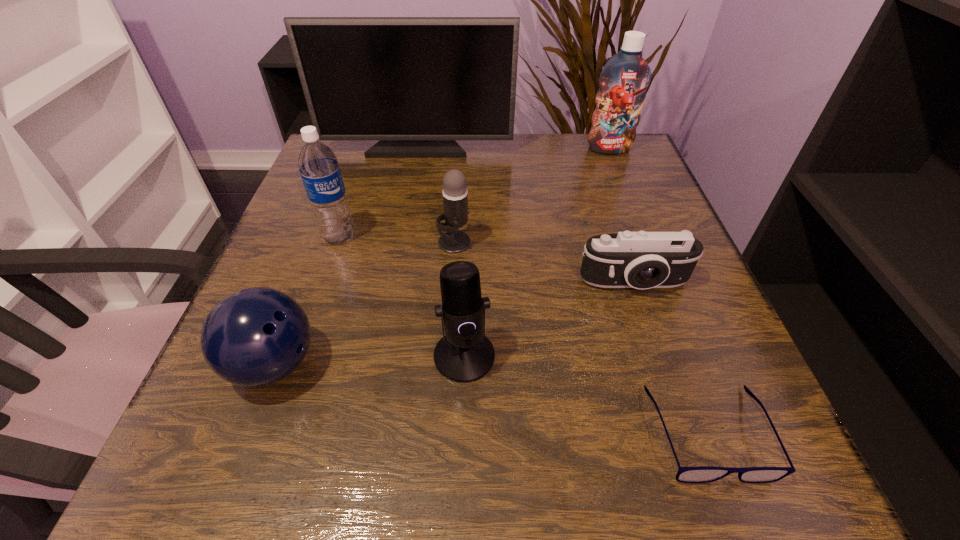
Locate an element on the screen. empty space between the shampoo and the water bottle is located at coordinates (474, 192).

Find the location of a particular element. This screenshot has height=540, width=960. free spot between the shortest object and the sixth tallest object is located at coordinates (492, 399).

Where is `free spot between the shampoo and the spectacles`? Image resolution: width=960 pixels, height=540 pixels. free spot between the shampoo and the spectacles is located at coordinates (659, 291).

Identify the location of free space between the farther microphone and the sixth tallest object. The image size is (960, 540). (364, 303).

The width and height of the screenshot is (960, 540). I want to click on vacant space that is in between the seventh tallest object and the farther microphone, so click(x=544, y=263).

Choose which object is the fourth nearest neighbor to the monitor. Please provide its 2D coordinates. Your answer should be formatted as a tuple, i.e. [(x, y)], where the tuple contains the x and y coordinates of a point satisfying the conditions above.

[(642, 260)]

This screenshot has height=540, width=960. Identify the location of object that is the third closest to the camera. (455, 195).

Locate an element on the screen. Image resolution: width=960 pixels, height=540 pixels. vacant position in the image that satisfies the following two spatial constraints: 1. on the screen side of the monitor; 2. on the surface of the bowling ball near the finger holes is located at coordinates (376, 364).